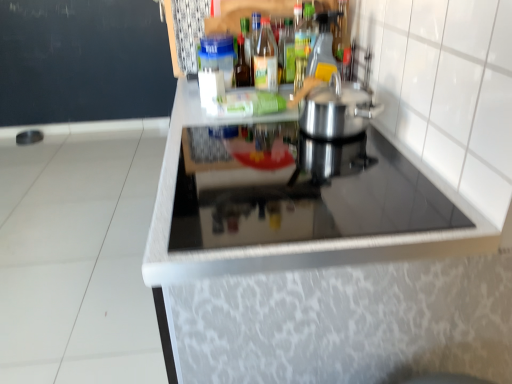
Question: Does black glass cooktop at center have a smaller size compared to translucent plastic bottle at upper center, which appears as the 2th bottle when viewed from the left?

Choices:
 (A) yes
 (B) no

Answer: (B)

Question: Does black glass cooktop at center appear on the right side of translucent plastic bottle at upper center, the 4th bottle in the right-to-left sequence?

Choices:
 (A) yes
 (B) no

Answer: (A)

Question: Considering the relative sizes of black glass cooktop at center and translucent plastic bottle at upper center, which appears as the 2th bottle when viewed from the left, in the image provided, is black glass cooktop at center taller than translucent plastic bottle at upper center, which appears as the 2th bottle when viewed from the left,?

Choices:
 (A) no
 (B) yes

Answer: (A)

Question: Considering the relative sizes of black glass cooktop at center and translucent plastic bottle at upper center, which appears as the 2th bottle when viewed from the left, in the image provided, is black glass cooktop at center bigger than translucent plastic bottle at upper center, which appears as the 2th bottle when viewed from the left,?

Choices:
 (A) no
 (B) yes

Answer: (B)

Question: Does black glass cooktop at center appear on the left side of translucent plastic bottle at upper center, which appears as the 2th bottle when viewed from the left?

Choices:
 (A) no
 (B) yes

Answer: (A)

Question: Is black glass cooktop at center to the left or to the right of transparent glass bottle at upper center, which is the 1th bottle from right to left, in the image?

Choices:
 (A) left
 (B) right

Answer: (A)

Question: From a real-world perspective, is black glass cooktop at center physically located above or below transparent glass bottle at upper center, which is the fifth bottle in left-to-right order?

Choices:
 (A) above
 (B) below

Answer: (B)

Question: Is black glass cooktop at center in front of or behind transparent glass bottle at upper center, which is the 1th bottle from right to left, in the image?

Choices:
 (A) front
 (B) behind

Answer: (A)

Question: Is black glass cooktop at center spatially inside transparent glass bottle at upper center, which is the fifth bottle in left-to-right order, or outside of it?

Choices:
 (A) inside
 (B) outside

Answer: (B)

Question: Considering the relative positions of translucent glass bottle at center, which is counted as the 1th bottle, starting from the left, and black glass cooktop at center in the image provided, is translucent glass bottle at center, which is counted as the 1th bottle, starting from the left, to the left or to the right of black glass cooktop at center?

Choices:
 (A) right
 (B) left

Answer: (B)

Question: From the image's perspective, is translucent glass bottle at center, acting as the 5th bottle starting from the right, above or below black glass cooktop at center?

Choices:
 (A) below
 (B) above

Answer: (B)

Question: From a real-world perspective, is translucent glass bottle at center, which is counted as the 1th bottle, starting from the left, physically located above or below black glass cooktop at center?

Choices:
 (A) above
 (B) below

Answer: (A)

Question: Is translucent glass bottle at center, acting as the 5th bottle starting from the right, inside or outside of black glass cooktop at center?

Choices:
 (A) outside
 (B) inside

Answer: (A)

Question: In terms of width, does black glass cooktop at center look wider or thinner when compared to translucent glass bottle at upper center, the 2th bottle in the right-to-left sequence?

Choices:
 (A) wide
 (B) thin

Answer: (A)

Question: Would you say black glass cooktop at center is to the left or to the right of translucent glass bottle at upper center, the 2th bottle in the right-to-left sequence, in the picture?

Choices:
 (A) right
 (B) left

Answer: (B)